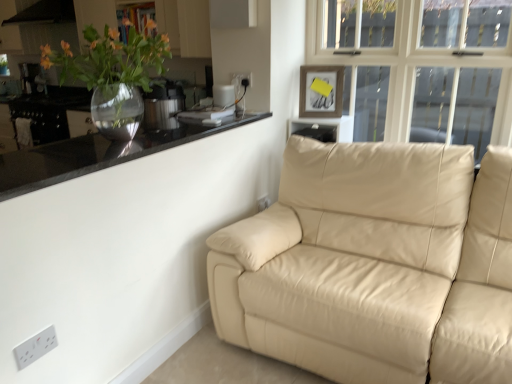
Question: Is clear glass vase at upper left positioned beyond the bounds of satin silver pressure cooker at upper left, which is the 1th appliance in right-to-left order?

Choices:
 (A) yes
 (B) no

Answer: (A)

Question: Is clear glass vase at upper left next to satin silver pressure cooker at upper left, which is the second appliance in left-to-right order?

Choices:
 (A) yes
 (B) no

Answer: (B)

Question: Does clear glass vase at upper left have a lesser height compared to satin silver pressure cooker at upper left, which is the 1th appliance in right-to-left order?

Choices:
 (A) no
 (B) yes

Answer: (A)

Question: Does clear glass vase at upper left appear on the right side of satin silver pressure cooker at upper left, which is the 1th appliance in right-to-left order?

Choices:
 (A) yes
 (B) no

Answer: (A)

Question: Is clear glass vase at upper left oriented towards satin silver pressure cooker at upper left, which is the first appliance in bottom-to-top order?

Choices:
 (A) no
 (B) yes

Answer: (A)

Question: From the image's perspective, is clear glass vase at upper left over satin silver pressure cooker at upper left, which is the 1th appliance in right-to-left order?

Choices:
 (A) no
 (B) yes

Answer: (A)

Question: From the image's perspective, would you say clear glass vase at upper left is shown under white plastic electric outlet at lower center, the 2th electric outlet viewed from the top?

Choices:
 (A) yes
 (B) no

Answer: (B)

Question: Is clear glass vase at upper left at the right side of white plastic electric outlet at lower center, the 1th electric outlet in the back-to-front sequence?

Choices:
 (A) yes
 (B) no

Answer: (B)

Question: Considering the relative sizes of clear glass vase at upper left and white plastic electric outlet at lower center, marked as the 3th electric outlet in a left-to-right arrangement, in the image provided, is clear glass vase at upper left smaller than white plastic electric outlet at lower center, marked as the 3th electric outlet in a left-to-right arrangement,?

Choices:
 (A) yes
 (B) no

Answer: (B)

Question: Considering the relative positions of clear glass vase at upper left and white plastic electric outlet at lower center, marked as the 2th electric outlet in a bottom-to-top arrangement, in the image provided, is clear glass vase at upper left in front of white plastic electric outlet at lower center, marked as the 2th electric outlet in a bottom-to-top arrangement,?

Choices:
 (A) no
 (B) yes

Answer: (B)

Question: Does clear glass vase at upper left have a greater height compared to white plastic electric outlet at lower center, which appears as the 3th electric outlet when viewed from the front?

Choices:
 (A) yes
 (B) no

Answer: (A)

Question: Is clear glass vase at upper left thinner than white plastic electric outlet at lower center, the 1th electric outlet in the back-to-front sequence?

Choices:
 (A) no
 (B) yes

Answer: (A)

Question: Is wooden picture frame at upper center wider than satin silver pressure cooker at upper left, which is counted as the 1th appliance, starting from the front?

Choices:
 (A) yes
 (B) no

Answer: (B)